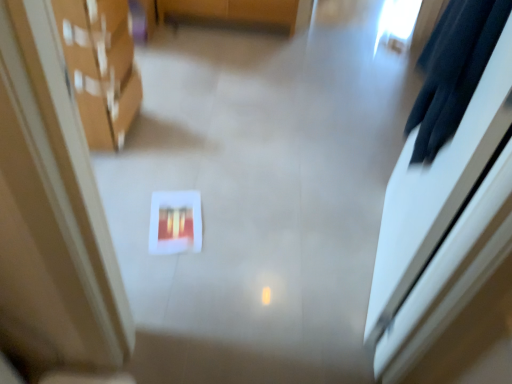
The width and height of the screenshot is (512, 384). What do you see at coordinates (453, 70) in the screenshot?
I see `black fabric robe at upper right` at bounding box center [453, 70].

The height and width of the screenshot is (384, 512). In order to click on matte red book at center in this screenshot , I will do `click(175, 222)`.

What is the approximate height of matte red book at center?

matte red book at center is 2.65 centimeters tall.

At what (x,y) coordinates should I click in order to perform the action: click on black fabric robe at upper right. Please return your answer as a coordinate pair (x, y). Looking at the image, I should click on pyautogui.click(x=453, y=70).

How different are the orientations of matte cardboard boxes at left and matte red book at center in degrees?

The facing directions of matte cardboard boxes at left and matte red book at center are 78.1 degrees apart.

Considering the sizes of matte cardboard boxes at left and matte red book at center in the image, is matte cardboard boxes at left taller or shorter than matte red book at center?

Considering their sizes, matte cardboard boxes at left has more height than matte red book at center.

From the image's perspective, is matte cardboard boxes at left positioned above or below matte red book at center?

matte cardboard boxes at left is above matte red book at center.

Considering the sizes of objects matte cardboard boxes at left and matte red book at center in the image provided, who is smaller, matte cardboard boxes at left or matte red book at center?

matte red book at center.

In the scene shown: Could you tell me if matte cardboard boxes at left is facing black fabric robe at upper right?

No, matte cardboard boxes at left does not turn towards black fabric robe at upper right.

Can you confirm if matte cardboard boxes at left is shorter than black fabric robe at upper right?

In fact, matte cardboard boxes at left may be taller than black fabric robe at upper right.

What's the angular difference between matte cardboard boxes at left and black fabric robe at upper right's facing directions?

The facing directions of matte cardboard boxes at left and black fabric robe at upper right are 167 degrees apart.

Considering the sizes of objects matte cardboard boxes at left and black fabric robe at upper right in the image provided, who is bigger, matte cardboard boxes at left or black fabric robe at upper right?

matte cardboard boxes at left is bigger.

Is black fabric robe at upper right facing towards matte cardboard boxes at left?

Yes.

Looking at this image, how different are the orientations of black fabric robe at upper right and matte cardboard boxes at left in degrees?

167 degrees separate the facing orientations of black fabric robe at upper right and matte cardboard boxes at left.

Considering the relative positions of black fabric robe at upper right and matte cardboard boxes at left in the image provided, is black fabric robe at upper right to the left or to the right of matte cardboard boxes at left?

black fabric robe at upper right is to the right of matte cardboard boxes at left.

Is point (451, 66) in front of point (126, 24)?

Yes, it is in front of point (126, 24).

Is matte cardboard boxes at left at the back of matte red book at center?

matte red book at center does not have its back to matte cardboard boxes at left.

At what (x,y) coordinates should I click in order to perform the action: click on furniture located above the matte red book at center (from a real-world perspective). Please return your answer as a coordinate pair (x, y). The image size is (512, 384). Looking at the image, I should click on (101, 67).

Is matte red book at center at the left side of matte cardboard boxes at left?

In fact, matte red book at center is to the right of matte cardboard boxes at left.

Is matte red book at center behind matte cardboard boxes at left?

Yes, matte red book at center is behind matte cardboard boxes at left.

Does matte red book at center have a larger size compared to black fabric robe at upper right?

Incorrect, matte red book at center is not larger than black fabric robe at upper right.

Measure the distance from matte red book at center to black fabric robe at upper right.

matte red book at center and black fabric robe at upper right are 3.35 feet apart.

Considering the positions of point (155, 253) and point (446, 28), is point (155, 253) closer or farther from the camera than point (446, 28)?

Point (155, 253).

Is matte red book at center taller than black fabric robe at upper right?

No.

Can we say black fabric robe at upper right lies outside matte red book at center?

black fabric robe at upper right lies outside matte red book at center's area.

Considering the relative sizes of black fabric robe at upper right and matte red book at center in the image provided, is black fabric robe at upper right shorter than matte red book at center?

In fact, black fabric robe at upper right may be taller than matte red book at center.

You are a GUI agent. You are given a task and a screenshot of the screen. Output one action in this format:
    pyautogui.click(x=<x>, y=<y>)
    Task: Click on the square on the left of the black fabric robe at upper right
    
    Given the screenshot: What is the action you would take?
    pyautogui.click(x=175, y=222)

From the picture: From the image's perspective, which one is positioned lower, black fabric robe at upper right or matte red book at center?

matte red book at center, from the image's perspective.

What are the coordinates of `square below the matte cardboard boxes at left (from a real-world perspective)` in the screenshot? It's located at (175, 222).

The image size is (512, 384). Identify the location of robe on the right of matte cardboard boxes at left. (453, 70).

Considering their positions, is matte red book at center positioned further to black fabric robe at upper right than matte cardboard boxes at left?

matte cardboard boxes at left is positioned further to the anchor black fabric robe at upper right.

Which object lies nearer to the anchor point matte red book at center, matte cardboard boxes at left or black fabric robe at upper right?

matte cardboard boxes at left is closer to matte red book at center.

Estimate the real-world distances between objects in this image. Which object is closer to matte cardboard boxes at left, black fabric robe at upper right or matte red book at center?

The object closer to matte cardboard boxes at left is matte red book at center.

Which object lies nearer to the anchor point matte cardboard boxes at left, matte red book at center or black fabric robe at upper right?

matte red book at center lies closer to matte cardboard boxes at left than the other object.

Looking at the image, which one is located further to matte red book at center, black fabric robe at upper right or matte cardboard boxes at left?

Based on the image, black fabric robe at upper right appears to be further to matte red book at center.

Looking at the image, which one is located further to black fabric robe at upper right, matte cardboard boxes at left or matte red book at center?

matte cardboard boxes at left lies further to black fabric robe at upper right than the other object.

You are a GUI agent. You are given a task and a screenshot of the screen. Output one action in this format:
    pyautogui.click(x=<x>, y=<y>)
    Task: Click on the square situated between matte cardboard boxes at left and black fabric robe at upper right from left to right
    
    Given the screenshot: What is the action you would take?
    pyautogui.click(x=175, y=222)